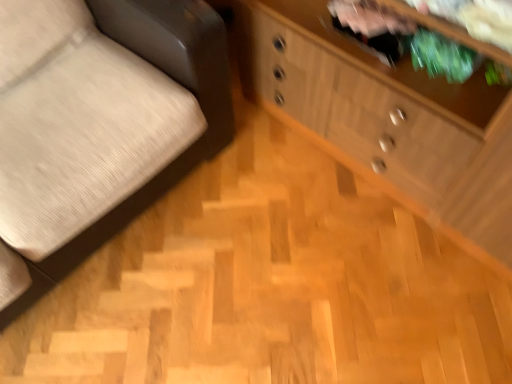
Measure the distance between point (382,159) and camera.

Point (382,159) and camera are 1.41 meters apart.

The height and width of the screenshot is (384, 512). Describe the element at coordinates (387, 120) in the screenshot. I see `wooden chest of drawers at upper right` at that location.

Locate an element on the screen. wooden chest of drawers at upper right is located at coordinates (387, 120).

Identify the location of wooden chest of drawers at upper right. This screenshot has width=512, height=384. (387, 120).